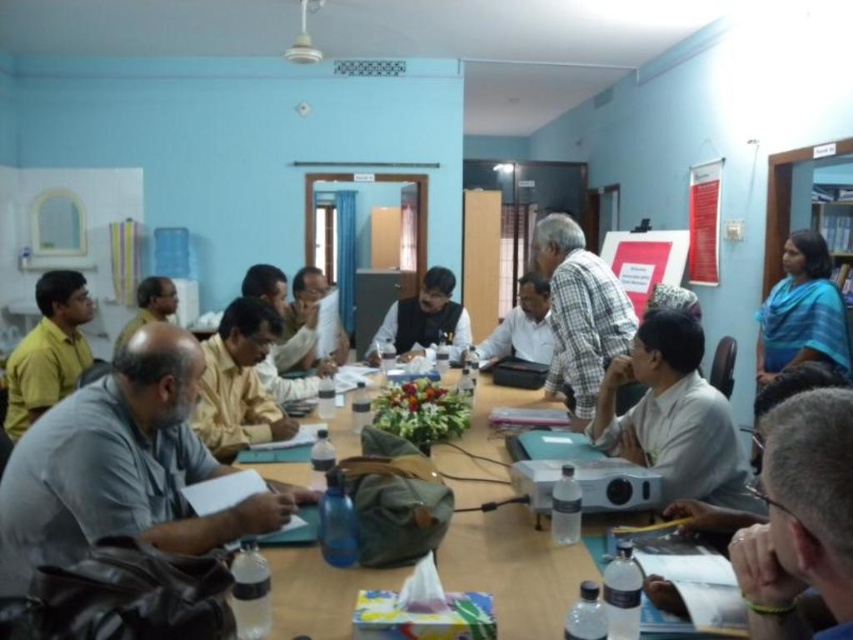
Question: Observing the image, what is the correct spatial positioning of checkered fabric shirt at center in reference to matte black shirt at center?

Choices:
 (A) above
 (B) below

Answer: (B)

Question: Is white matte shirt at center to the left of white shirt at center from the viewer's perspective?

Choices:
 (A) yes
 (B) no

Answer: (B)

Question: Which point appears closest to the camera in this image?

Choices:
 (A) pos(548,323)
 (B) pos(508,394)

Answer: (B)

Question: Which object is positioned farthest from the white matte shirt at center?

Choices:
 (A) blue silk saree at right
 (B) red paperboard at upper right
 (C) dark gray fabric vest at center
 (D) matte black shirt at center

Answer: (B)

Question: In this image, where is white matte shirt at center located relative to dark gray fabric vest at center?

Choices:
 (A) left
 (B) right

Answer: (B)

Question: Which object appears closest to the camera in this image?

Choices:
 (A) white matte shirt at center
 (B) red paperboard at upper right

Answer: (A)